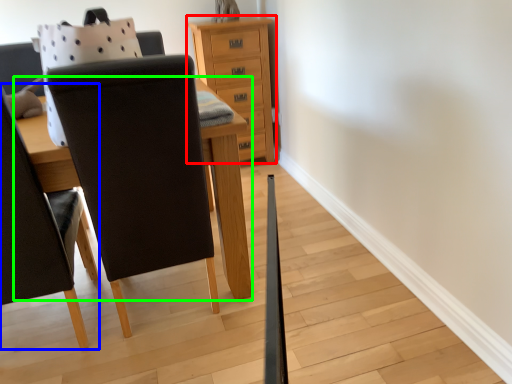
Question: Based on their relative distances, which object is nearer to chest of drawers (highlighted by a red box)? Choose from chair (highlighted by a blue box) and table (highlighted by a green box).

Choices:
 (A) chair
 (B) table

Answer: (B)